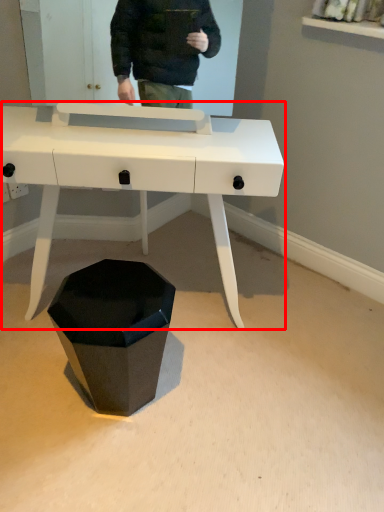
Question: From the image's perspective, what is the correct spatial positioning of desk (annotated by the red box) in reference to waste container?

Choices:
 (A) above
 (B) below

Answer: (A)